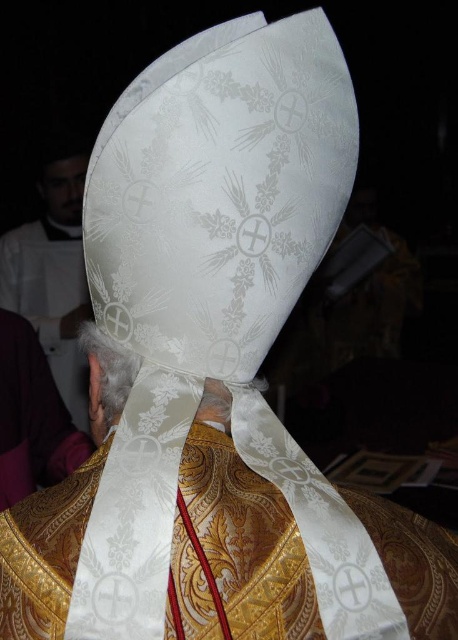
Question: Which point appears closest to the camera in this image?

Choices:
 (A) (54, 188)
 (B) (99, 433)

Answer: (B)

Question: Which of these objects is positioned closest to the white silk vestment at upper left?

Choices:
 (A) matte black head at upper left
 (B) white satin headpiece at center

Answer: (A)

Question: Can you confirm if white silk vestment at upper left is positioned to the right of matte black head at upper left?

Choices:
 (A) yes
 (B) no

Answer: (B)

Question: Does white satin headpiece at center appear over white satin headband at center?

Choices:
 (A) yes
 (B) no

Answer: (B)

Question: Can you confirm if white silk vestment at upper left is positioned below matte black head at upper left?

Choices:
 (A) no
 (B) yes

Answer: (B)

Question: Which object is the farthest from the white silk vestment at upper left?

Choices:
 (A) white satin headband at center
 (B) matte black head at upper left

Answer: (A)